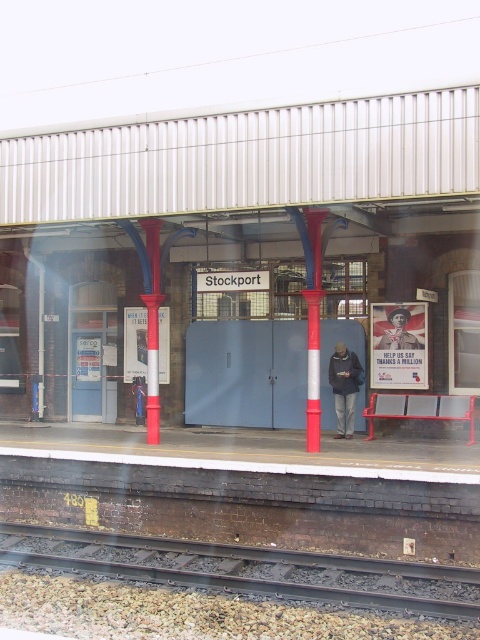
Question: Among these points, which one is farthest from the camera?

Choices:
 (A) (252, 552)
 (B) (396, 333)
 (C) (338, 433)

Answer: (B)

Question: Is smooth metal track at lower center above dark blue jacket at center?

Choices:
 (A) no
 (B) yes

Answer: (A)

Question: Where is smooth metal track at lower center located in relation to matte black jacket at center in the image?

Choices:
 (A) above
 (B) below

Answer: (B)

Question: Which point appears closest to the camera in this image?

Choices:
 (A) (238, 556)
 (B) (403, 326)
 (C) (352, 406)

Answer: (A)

Question: Which object is the closest to the smooth metal track at lower center?

Choices:
 (A) dark blue jacket at center
 (B) matte black jacket at center

Answer: (A)

Question: Where is smooth metal track at lower center located in relation to matte black jacket at center in the image?

Choices:
 (A) right
 (B) left

Answer: (B)